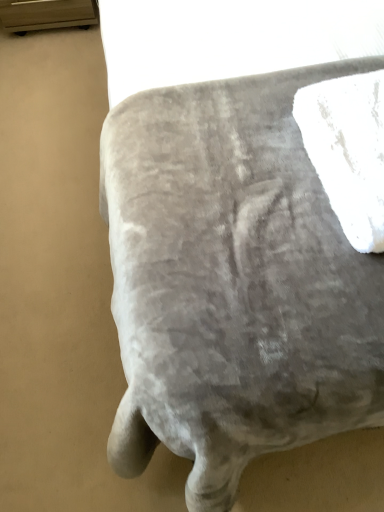
Question: Considering the relative sizes of white fluffy bath towel at upper right and velvet ottoman at center in the image provided, is white fluffy bath towel at upper right taller than velvet ottoman at center?

Choices:
 (A) yes
 (B) no

Answer: (A)

Question: Does white fluffy bath towel at upper right appear on the left side of velvet ottoman at center?

Choices:
 (A) yes
 (B) no

Answer: (B)

Question: Does white fluffy bath towel at upper right have a smaller size compared to velvet ottoman at center?

Choices:
 (A) no
 (B) yes

Answer: (B)

Question: Is velvet ottoman at center located within white fluffy bath towel at upper right?

Choices:
 (A) no
 (B) yes

Answer: (A)

Question: Considering the relative sizes of white fluffy bath towel at upper right and velvet ottoman at center in the image provided, is white fluffy bath towel at upper right thinner than velvet ottoman at center?

Choices:
 (A) yes
 (B) no

Answer: (A)

Question: Is white fluffy bath towel at upper right at the right side of velvet ottoman at center?

Choices:
 (A) yes
 (B) no

Answer: (A)

Question: Considering the relative positions of velvet ottoman at center and white fluffy bath towel at upper right in the image provided, is velvet ottoman at center to the right of white fluffy bath towel at upper right from the viewer's perspective?

Choices:
 (A) no
 (B) yes

Answer: (A)

Question: Does velvet ottoman at center contain white fluffy bath towel at upper right?

Choices:
 (A) yes
 (B) no

Answer: (B)

Question: Would you say velvet ottoman at center is outside white fluffy bath towel at upper right?

Choices:
 (A) no
 (B) yes

Answer: (B)

Question: Does velvet ottoman at center have a greater width compared to white fluffy bath towel at upper right?

Choices:
 (A) no
 (B) yes

Answer: (B)

Question: Could you tell me if velvet ottoman at center is turned towards white fluffy bath towel at upper right?

Choices:
 (A) no
 (B) yes

Answer: (A)

Question: Are velvet ottoman at center and white fluffy bath towel at upper right making contact?

Choices:
 (A) yes
 (B) no

Answer: (B)

Question: From a real-world perspective, relative to velvet ottoman at center, is white fluffy bath towel at upper right vertically above or below?

Choices:
 (A) below
 (B) above

Answer: (B)